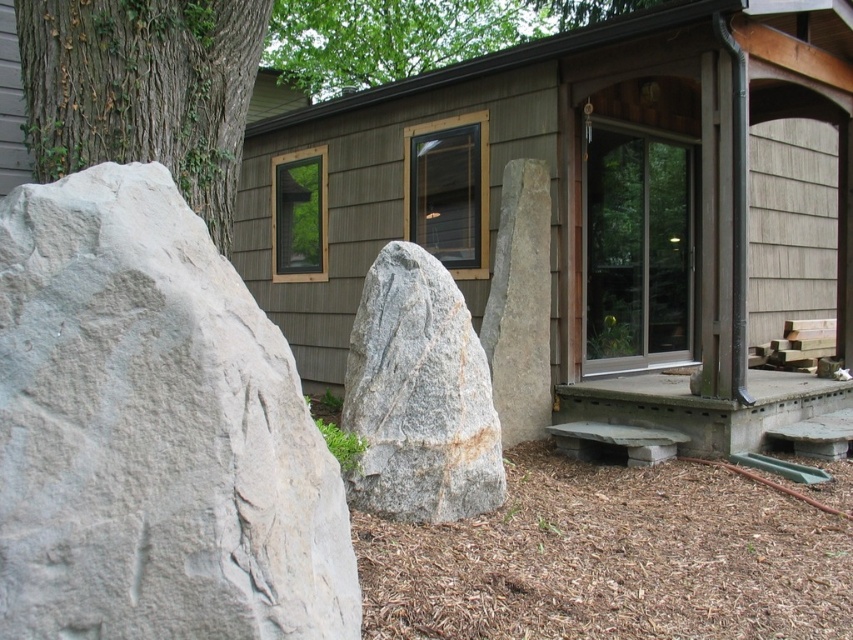
Question: Can you confirm if green rough bark tree at left is positioned below gray granite rock at center?

Choices:
 (A) no
 (B) yes

Answer: (A)

Question: Estimate the real-world distances between objects in this image. Which object is farther from the gray rough rock at left?

Choices:
 (A) green rough bark tree at upper left
 (B) wooden cabin at center
 (C) concrete at lower right
 (D) green rough bark tree at left

Answer: (B)

Question: Can you confirm if gray rough rock at left is thinner than gray granite rock at center?

Choices:
 (A) yes
 (B) no

Answer: (B)

Question: Does gray rough rock at left have a larger size compared to green rough bark tree at left?

Choices:
 (A) no
 (B) yes

Answer: (B)

Question: Which point is closer to the camera?

Choices:
 (A) green rough bark tree at left
 (B) gray granite rock at center
 (C) wooden cabin at center
 (D) concrete at lower right

Answer: (A)

Question: Considering the real-world distances, which object is closest to the gray rough rock at left?

Choices:
 (A) wooden cabin at center
 (B) green rough bark tree at upper left
 (C) green rough bark tree at left

Answer: (C)